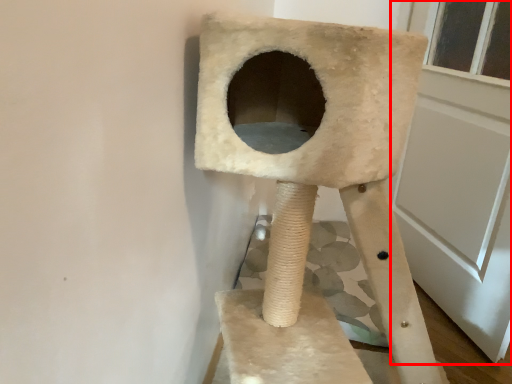
Question: From the image's perspective, where is screen door (annotated by the red box) located in relation to furniture in the image?

Choices:
 (A) below
 (B) above

Answer: (B)